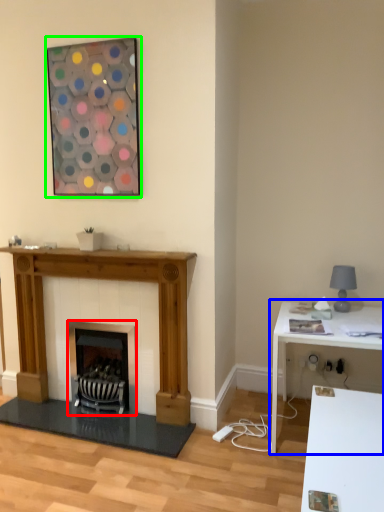
Question: Estimate the real-world distances between objects in this image. Which object is closer to wood burning stove (highlighted by a red box), table (highlighted by a blue box) or picture frame (highlighted by a green box)?

Choices:
 (A) table
 (B) picture frame

Answer: (A)